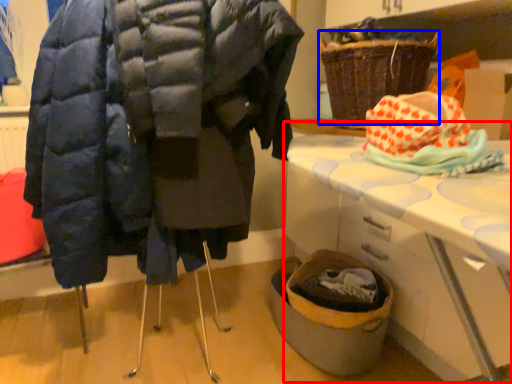
Question: Which object is further to the camera taking this photo, table (highlighted by a red box) or basket (highlighted by a blue box)?

Choices:
 (A) table
 (B) basket

Answer: (B)